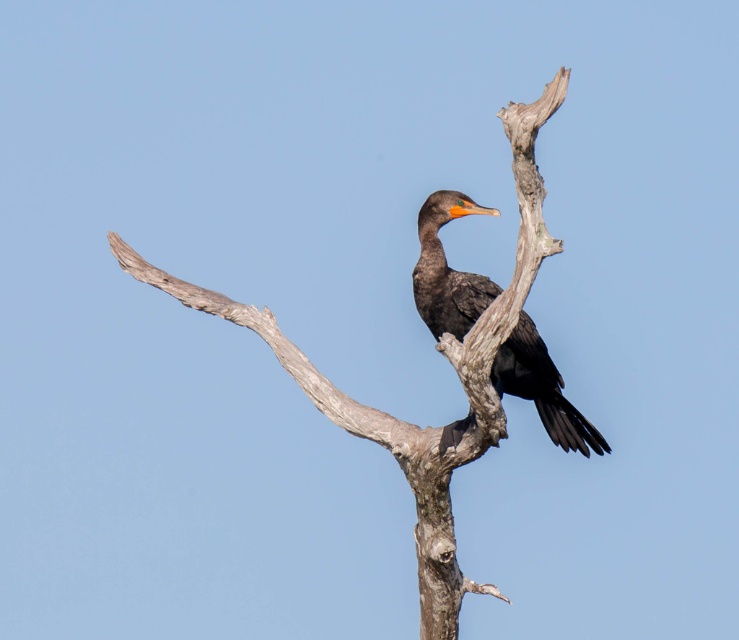
Question: Does smooth gray branch at center appear over shiny black bird at center?

Choices:
 (A) no
 (B) yes

Answer: (B)

Question: Does smooth gray branch at center have a smaller size compared to shiny black bird at center?

Choices:
 (A) yes
 (B) no

Answer: (B)

Question: Can you confirm if smooth gray branch at center is positioned to the right of shiny black bird at center?

Choices:
 (A) yes
 (B) no

Answer: (B)

Question: Which object appears farthest from the camera in this image?

Choices:
 (A) shiny black bird at center
 (B) smooth gray branch at center

Answer: (A)

Question: Which of the following is the closest to the observer?

Choices:
 (A) smooth gray branch at center
 (B) shiny black bird at center

Answer: (A)